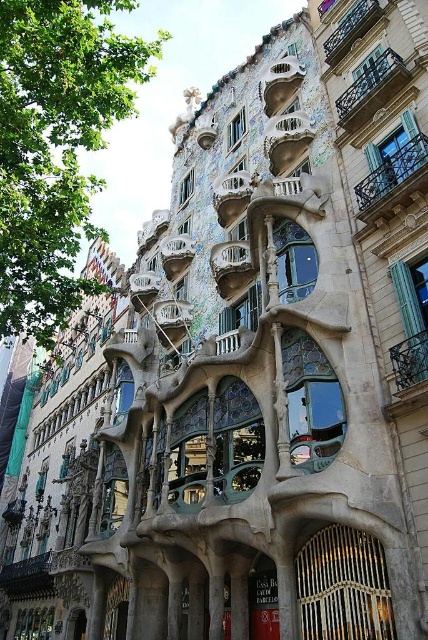
Question: Which of the following is the closest to the observer?

Choices:
 (A) (386, 54)
 (B) (359, 35)
 (C) (386, 179)

Answer: (C)

Question: Is iron forged balcony at upper right thinner than dark brown wrought iron balcony at upper center?

Choices:
 (A) yes
 (B) no

Answer: (B)

Question: Can you confirm if iron forged balcony at upper right is bigger than polished bronze balcony at upper right?

Choices:
 (A) no
 (B) yes

Answer: (A)

Question: Among these points, which one is nearest to the camera?

Choices:
 (A) (344, 22)
 (B) (371, 100)

Answer: (B)

Question: Estimate the real-world distances between objects in this image. Which object is closer to the polished bronze balcony at upper right?

Choices:
 (A) dark brown wrought iron balcony at upper center
 (B) iron forged balcony at upper right

Answer: (A)

Question: Does iron forged balcony at upper right appear on the left side of dark brown wrought iron balcony at upper center?

Choices:
 (A) no
 (B) yes

Answer: (A)